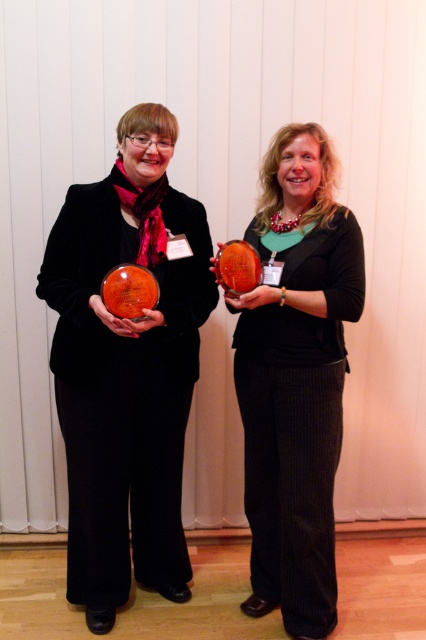
You are organizing a small event and need to place two awards on a shelf. The shelf has a width of 15 inches. You have the matte orange glass bowl at center and the matte orange trophy at center. Can both awards fit side by side on the shelf without overlapping?

The matte orange glass bowl at center and matte orange trophy at center are 14.82 inches apart from each other. Since the shelf is 15 inches wide, there is enough space to place both awards side by side without overlapping.

You are organizing a display and need to place the matte orange glass bowl at center and the matte orange trophy at center on a shelf. If the shelf has a height limit of 12 inches, which object would you choose to ensure it fits without exceeding the height limit?

The matte orange trophy at center should be chosen because it is shorter than the matte orange glass bowl at center, which is taller and may exceed the 12 inch height limit.

You are standing in the room and want to place a matte orange glass bowl exactly at the center of the room. Is the point at coordinates point (126,369) the correct location?

Yes, the point (126,369) is where the matte orange glass bowl at center is located, so it is the correct center point.